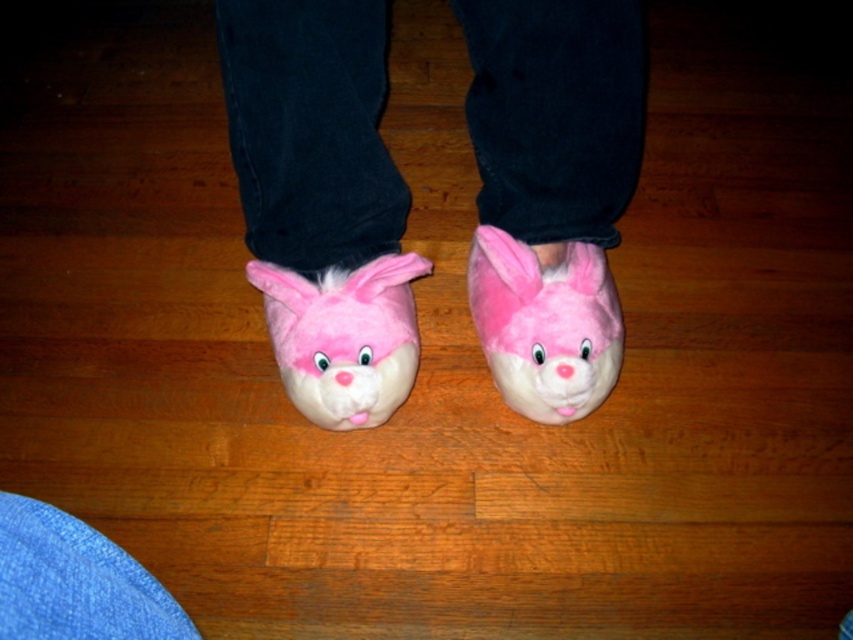
Question: Is fluffy pink slippers at center positioned in front of fluffy pink plush at center?

Choices:
 (A) no
 (B) yes

Answer: (B)

Question: Estimate the real-world distances between objects in this image. Which object is farther from the fluffy pink plush at center?

Choices:
 (A) fluffy pink plush bunny at center
 (B) fluffy pink slippers at center

Answer: (A)

Question: Which point is closer to the camera?

Choices:
 (A) fluffy pink slippers at center
 (B) fluffy pink plush at center

Answer: (A)

Question: Does fluffy pink plush at center have a greater width compared to fluffy pink plush bunny at center?

Choices:
 (A) yes
 (B) no

Answer: (B)

Question: Which point is closer to the camera?

Choices:
 (A) fluffy pink plush at center
 (B) fluffy pink slippers at center
 (C) fluffy pink plush bunny at center

Answer: (B)

Question: Does fluffy pink slippers at center come in front of fluffy pink plush at center?

Choices:
 (A) no
 (B) yes

Answer: (B)